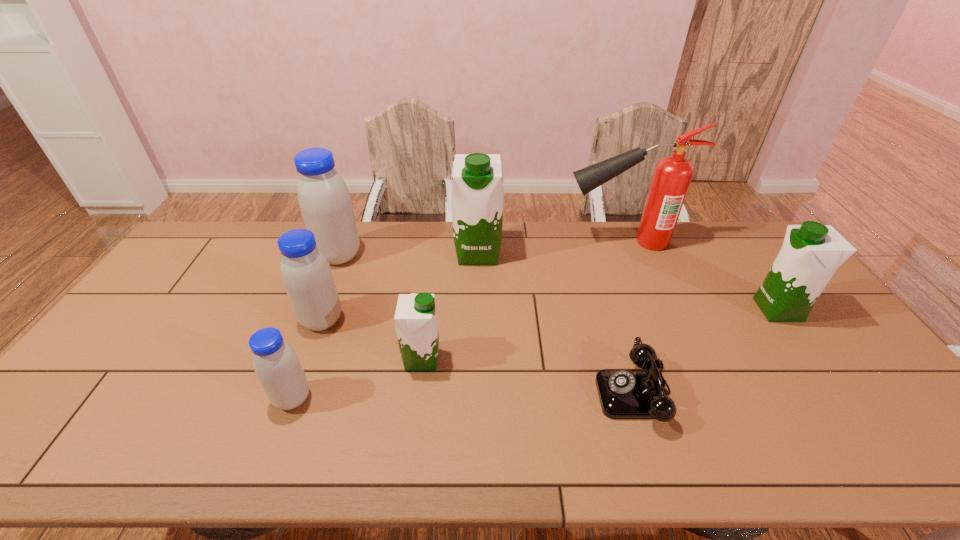
This screenshot has height=540, width=960. Find the location of `unoccupied area between the farthest blue soya milk and the fourth soya milk from left to right`. unoccupied area between the farthest blue soya milk and the fourth soya milk from left to right is located at coordinates coord(380,308).

I want to click on vacant space that is in between the shortest object and the nearest soya milk, so click(464, 395).

Locate an element on the screen. object that is the seventh nearest to the farthest blue soya milk is located at coordinates (811, 253).

Identify which object is the second nearest to the biggest green soya milk. Please provide its 2D coordinates. Your answer should be formatted as a tuple, i.e. [(x, y)], where the tuple contains the x and y coordinates of a point satisfying the conditions above.

[(324, 200)]

Identify the location of soya milk that is the closest to the second farthest green soya milk. This screenshot has height=540, width=960. (477, 194).

Select which soya milk is the third closest to the second nearest blue soya milk. Please provide its 2D coordinates. Your answer should be formatted as a tuple, i.e. [(x, y)], where the tuple contains the x and y coordinates of a point satisfying the conditions above.

[(416, 324)]

Identify which blue soya milk is located as the second nearest to the second nearest blue soya milk. Please provide its 2D coordinates. Your answer should be formatted as a tuple, i.e. [(x, y)], where the tuple contains the x and y coordinates of a point satisfying the conditions above.

[(324, 200)]

Locate which blue soya milk ranks third in proximity to the second farthest green soya milk. Please provide its 2D coordinates. Your answer should be formatted as a tuple, i.e. [(x, y)], where the tuple contains the x and y coordinates of a point satisfying the conditions above.

[(277, 366)]

Identify which green soya milk is located as the second nearest to the biggest green soya milk. Please provide its 2D coordinates. Your answer should be formatted as a tuple, i.e. [(x, y)], where the tuple contains the x and y coordinates of a point satisfying the conditions above.

[(811, 253)]

Locate which green soya milk ranks second in proximity to the fourth object from right to left. Please provide its 2D coordinates. Your answer should be formatted as a tuple, i.e. [(x, y)], where the tuple contains the x and y coordinates of a point satisfying the conditions above.

[(811, 253)]